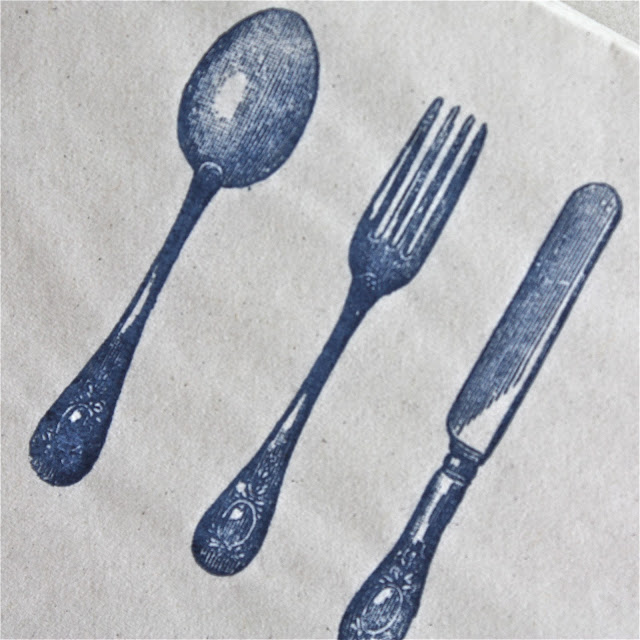
You are a GUI agent. You are given a task and a screenshot of the screen. Output one action in this format:
    pyautogui.click(x=<x>, y=<y>)
    Task: Click on the you eat soup with this spoon
    This screenshot has width=640, height=640.
    Given the screenshot: What is the action you would take?
    pyautogui.click(x=260, y=102)